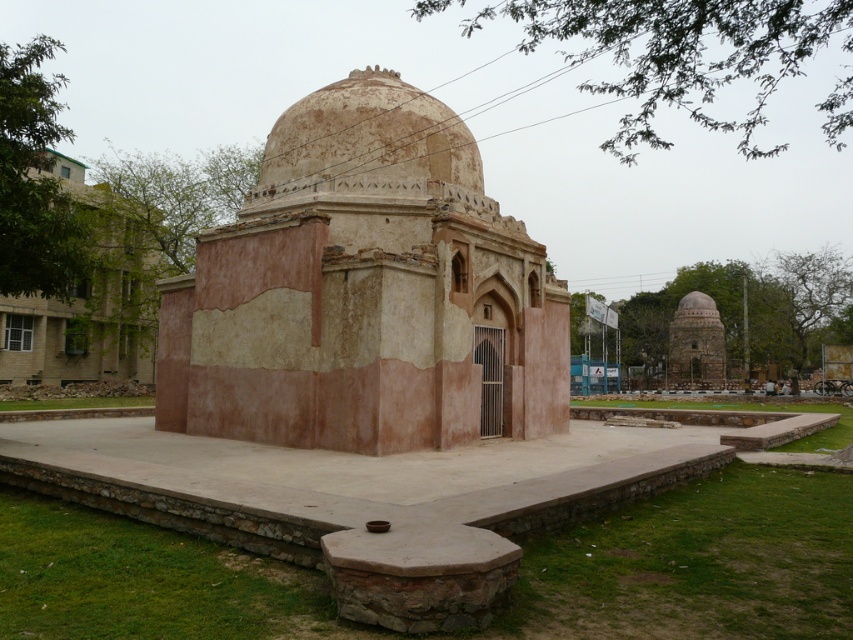
In the scene shown: Between rustic stone dome at center and beige stone dome at center, which one is positioned lower?

rustic stone dome at center is below.

Is point (511, 337) closer to camera compared to point (54, 166)?

That is True.

I want to click on rustic stone dome at center, so click(364, 291).

Does rustic stone dome at center have a lesser width compared to brown textured dome at center?

In fact, rustic stone dome at center might be wider than brown textured dome at center.

This screenshot has width=853, height=640. Describe the element at coordinates (364, 291) in the screenshot. I see `rustic stone dome at center` at that location.

In order to click on rustic stone dome at center in this screenshot , I will do `click(364, 291)`.

Is beige stone dome at center bigger than brown textured dome at center?

Correct, beige stone dome at center is larger in size than brown textured dome at center.

In the scene shown: Between beige stone dome at center and brown textured dome at center, which one has more height?

Standing taller between the two is beige stone dome at center.

Is point (88, 301) behind point (428, 141)?

That is True.

Locate an element on the screen. The width and height of the screenshot is (853, 640). beige stone dome at center is located at coordinates (86, 300).